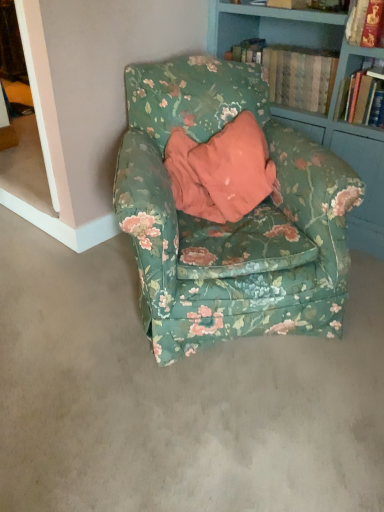
What is the approximate height of hardcover book at upper right, placed as the 1th book when sorted from right to left?

hardcover book at upper right, placed as the 1th book when sorted from right to left, is 27.10 centimeters tall.

Identify the location of floral fabric armchair at center. The height and width of the screenshot is (512, 384). (176, 396).

In order to face floral fabric armchair at center, should I rotate leftwards or rightwards?

To align with it, rotate right about 3.550°.

Identify the location of hardcover book at upper right, the second book from the left. This screenshot has width=384, height=512. (364, 96).

Consider the image. Is hardcover book at upper right, the second book from the left, not within hardcover book at upper right, marked as the first book in a left-to-right arrangement?

Yes, hardcover book at upper right, the second book from the left, is located beyond the bounds of hardcover book at upper right, marked as the first book in a left-to-right arrangement.

Could you measure the distance between hardcover book at upper right, placed as the 1th book when sorted from right to left, and hardcover book at upper right, marked as the first book in a left-to-right arrangement?

8.89 inches.

Considering the relative sizes of hardcover book at upper right, the second book from the left, and hardcover book at upper right, the 2th book from the right, in the image provided, is hardcover book at upper right, the second book from the left, taller than hardcover book at upper right, the 2th book from the right,?

Yes, hardcover book at upper right, the second book from the left, is taller than hardcover book at upper right, the 2th book from the right.

Is hardcover book at upper right, the second book from the left, facing away from hardcover book at upper right, the 2th book from the right?

No, hardcover book at upper right, the second book from the left, is not facing the opposite direction of hardcover book at upper right, the 2th book from the right.

Does floral fabric armchair at center contain floral fabric armchair at center?

That's incorrect, floral fabric armchair at center is not inside floral fabric armchair at center.

Identify the location of concrete located in front of the floral fabric armchair at center. tap(176, 396).

Is floral fabric armchair at center further to camera compared to floral fabric armchair at center?

Yes, it is behind floral fabric armchair at center.

From a real-world perspective, who is located lower, floral fabric armchair at center or floral fabric armchair at center?

floral fabric armchair at center, from a real-world perspective.

Is hardcover book at upper right, the second book from the left, smaller than floral fabric armchair at center?

Correct, hardcover book at upper right, the second book from the left, occupies less space than floral fabric armchair at center.

Is hardcover book at upper right, placed as the 1th book when sorted from right to left, looking in the opposite direction of floral fabric armchair at center?

No, hardcover book at upper right, placed as the 1th book when sorted from right to left, is not facing the opposite direction of floral fabric armchair at center.

Which object is more forward, hardcover book at upper right, the second book from the left, or floral fabric armchair at center?

floral fabric armchair at center is more forward.

From the image's perspective, is hardcover book at upper right, the second book from the left, under floral fabric armchair at center?

No.

Considering the relative sizes of floral fabric armchair at center and hardcover book at upper right, marked as the first book in a left-to-right arrangement, in the image provided, is floral fabric armchair at center shorter than hardcover book at upper right, marked as the first book in a left-to-right arrangement,?

No, floral fabric armchair at center is not shorter than hardcover book at upper right, marked as the first book in a left-to-right arrangement.

Which object is wider, floral fabric armchair at center or hardcover book at upper right, marked as the first book in a left-to-right arrangement?

Wider between the two is floral fabric armchair at center.

In terms of size, does floral fabric armchair at center appear bigger or smaller than hardcover book at upper right, marked as the first book in a left-to-right arrangement?

Clearly, floral fabric armchair at center is larger in size than hardcover book at upper right, marked as the first book in a left-to-right arrangement.

Is floral fabric armchair at center at the right side of hardcover book at upper right, marked as the first book in a left-to-right arrangement?

No, floral fabric armchair at center is not to the right of hardcover book at upper right, marked as the first book in a left-to-right arrangement.

Relative to hardcover book at upper right, the second book from the left, is floral fabric armchair at center in front or behind?

In the image, floral fabric armchair at center appears in front of hardcover book at upper right, the second book from the left.

From the floral fabric armchair at center, count 2nd book to the right and point to it. Please provide its 2D coordinates.

[(364, 96)]

Is floral fabric armchair at center next to hardcover book at upper right, placed as the 1th book when sorted from right to left?

No, floral fabric armchair at center is not in contact with hardcover book at upper right, placed as the 1th book when sorted from right to left.

Is floral fabric armchair at center oriented towards hardcover book at upper right, the second book from the left?

No, floral fabric armchair at center is not turned towards hardcover book at upper right, the second book from the left.

In the image, is hardcover book at upper right, the 2th book from the right, on the left side or the right side of floral fabric armchair at center?

Based on their positions, hardcover book at upper right, the 2th book from the right, is located to the right of floral fabric armchair at center.

Considering the points (335, 65) and (96, 311), which point is behind, point (335, 65) or point (96, 311)?

Point (335, 65)

At what (x,y) coordinates should I click in order to perform the action: click on book that is the 2nd object located behind the floral fabric armchair at center. Please return your answer as a coordinate pair (x, y). The height and width of the screenshot is (512, 384). Looking at the image, I should click on (299, 76).

Which is in front, hardcover book at upper right, the 2th book from the right, or floral fabric armchair at center?

Positioned in front is floral fabric armchair at center.

From the image's perspective, does floral fabric armchair at center appear lower than hardcover book at upper right, the second book from the left?

Correct, floral fabric armchair at center appears lower than hardcover book at upper right, the second book from the left, in the image.

Between floral fabric armchair at center and hardcover book at upper right, the second book from the left, which one has less height?

hardcover book at upper right, the second book from the left, is shorter.

Is floral fabric armchair at center situated inside hardcover book at upper right, the second book from the left, or outside?

floral fabric armchair at center is located beyond the bounds of hardcover book at upper right, the second book from the left.

Is point (201, 117) positioned before point (342, 98)?

Yes.

Find the location of a particular element. Image resolution: width=384 pixels, height=512 pixels. book in front of the hardcover book at upper right, marked as the first book in a left-to-right arrangement is located at coordinates (364, 96).

Find the location of `chair above the floral fabric armchair at center (from the image's perspective)`. chair above the floral fabric armchair at center (from the image's perspective) is located at coordinates click(229, 222).

Estimate the real-world distances between objects in this image. Which object is further from hardcover book at upper right, placed as the 1th book when sorted from right to left, hardcover book at upper right, marked as the first book in a left-to-right arrangement, or floral fabric armchair at center?

floral fabric armchair at center is positioned further to the anchor hardcover book at upper right, placed as the 1th book when sorted from right to left.

Based on their spatial positions, is hardcover book at upper right, placed as the 1th book when sorted from right to left, or floral fabric armchair at center closer to floral fabric armchair at center?

floral fabric armchair at center lies closer to floral fabric armchair at center than the other object.

Estimate the real-world distances between objects in this image. Which object is further from floral fabric armchair at center, hardcover book at upper right, the 2th book from the right, or hardcover book at upper right, placed as the 1th book when sorted from right to left?

hardcover book at upper right, the 2th book from the right.

Estimate the real-world distances between objects in this image. Which object is closer to hardcover book at upper right, the 2th book from the right, floral fabric armchair at center or hardcover book at upper right, the second book from the left?

The object closer to hardcover book at upper right, the 2th book from the right, is hardcover book at upper right, the second book from the left.

Looking at the image, which one is located further to floral fabric armchair at center, hardcover book at upper right, the 2th book from the right, or hardcover book at upper right, the second book from the left?

hardcover book at upper right, the second book from the left, is positioned further to the anchor floral fabric armchair at center.

When comparing their distances from hardcover book at upper right, the 2th book from the right, does floral fabric armchair at center or floral fabric armchair at center seem closer?

floral fabric armchair at center is positioned closer to the anchor hardcover book at upper right, the 2th book from the right.

From the image, which object appears to be farther from floral fabric armchair at center, hardcover book at upper right, the 2th book from the right, or floral fabric armchair at center?

Among the two, hardcover book at upper right, the 2th book from the right, is located further to floral fabric armchair at center.

Which object lies nearer to the anchor point hardcover book at upper right, marked as the first book in a left-to-right arrangement, hardcover book at upper right, the second book from the left, or floral fabric armchair at center?

hardcover book at upper right, the second book from the left, is closer to hardcover book at upper right, marked as the first book in a left-to-right arrangement.

Where is `book located between floral fabric armchair at center and hardcover book at upper right, the 2th book from the right, in the depth direction`? The image size is (384, 512). book located between floral fabric armchair at center and hardcover book at upper right, the 2th book from the right, in the depth direction is located at coordinates (364, 96).

The height and width of the screenshot is (512, 384). I want to click on book between floral fabric armchair at center and hardcover book at upper right, marked as the first book in a left-to-right arrangement, along the z-axis, so click(x=364, y=96).

At what (x,y) coordinates should I click in order to perform the action: click on chair located between floral fabric armchair at center and hardcover book at upper right, the second book from the left, in the left-right direction. Please return your answer as a coordinate pair (x, y). Looking at the image, I should click on (229, 222).

This screenshot has width=384, height=512. Identify the location of chair positioned between floral fabric armchair at center and hardcover book at upper right, marked as the first book in a left-to-right arrangement, from near to far. pyautogui.click(x=229, y=222).